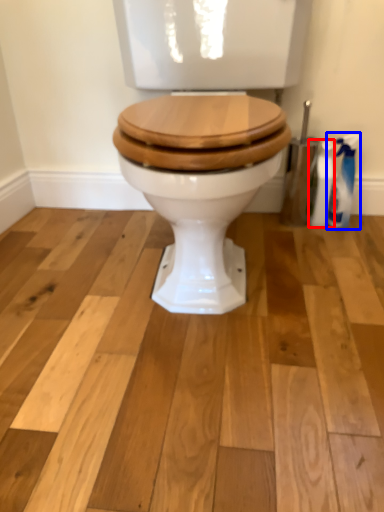
Question: Which point is closer to the camera, cleaning product (highlighted by a red box) or cleaning product (highlighted by a blue box)?

Choices:
 (A) cleaning product
 (B) cleaning product

Answer: (B)